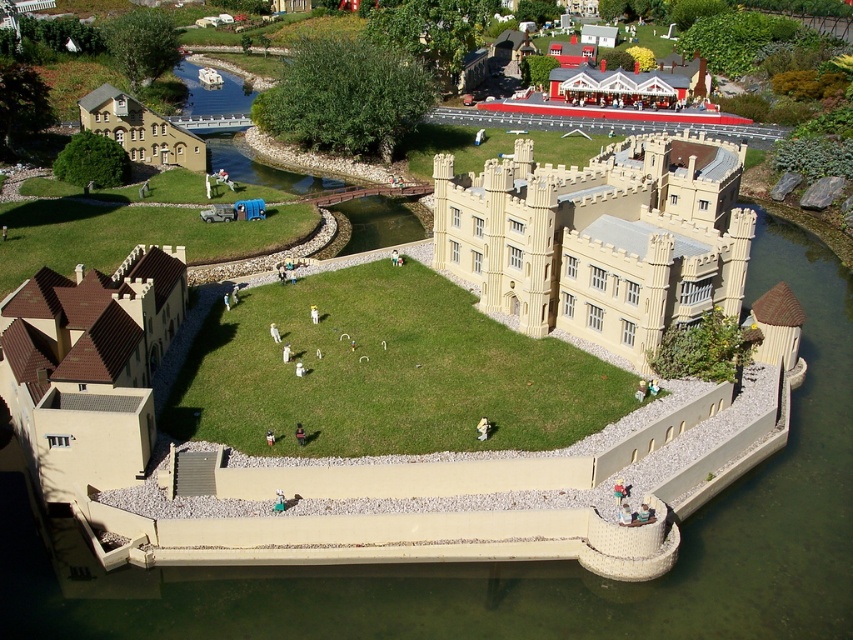
Does brown tiled roof at lower left have a lesser width compared to beige stone building at upper left?

Yes, brown tiled roof at lower left is thinner than beige stone building at upper left.

Does brown tiled roof at lower left have a smaller size compared to beige stone building at upper left?

Actually, brown tiled roof at lower left might be larger than beige stone building at upper left.

Measure the distance between point (28,285) and camera.

Point (28,285) is 64.84 meters away from camera.

At what (x,y) coordinates should I click in order to perform the action: click on brown tiled roof at lower left. Please return your answer as a coordinate pair (x, y). This screenshot has height=640, width=853. Looking at the image, I should click on (x=90, y=365).

Between beige stone castle at center and brown tiled roof at lower left, which one has more height?

Standing taller between the two is beige stone castle at center.

Does beige stone castle at center lie behind brown tiled roof at lower left?

Yes, beige stone castle at center is behind brown tiled roof at lower left.

Where is `beige stone castle at center`? beige stone castle at center is located at coordinates (601, 237).

The image size is (853, 640). In order to click on beige stone castle at center in this screenshot , I will do `click(601, 237)`.

Is beige stone castle at center smaller than beige stone building at upper left?

Incorrect, beige stone castle at center is not smaller in size than beige stone building at upper left.

Where is `beige stone castle at center`? This screenshot has width=853, height=640. beige stone castle at center is located at coordinates (601, 237).

Which is in front, point (512, 262) or point (142, 125)?

Point (512, 262) is more forward.

Identify the location of beige stone castle at center. (601, 237).